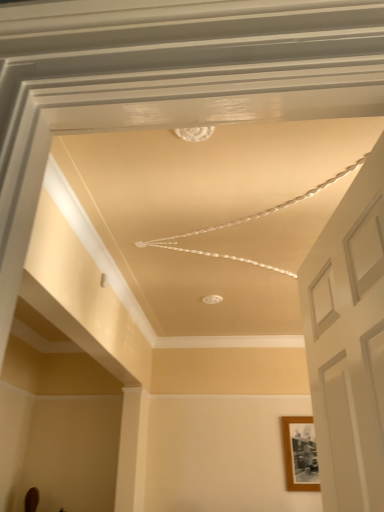
Question: Would you say white matte door at right is outside wooden photo frame at right?

Choices:
 (A) yes
 (B) no

Answer: (A)

Question: Does white matte door at right have a larger size compared to wooden photo frame at right?

Choices:
 (A) no
 (B) yes

Answer: (B)

Question: Can you confirm if white matte door at right is smaller than wooden photo frame at right?

Choices:
 (A) no
 (B) yes

Answer: (A)

Question: Could you tell me if white matte door at right is turned towards wooden photo frame at right?

Choices:
 (A) yes
 (B) no

Answer: (B)

Question: From the image's perspective, is white matte door at right under wooden photo frame at right?

Choices:
 (A) no
 (B) yes

Answer: (A)

Question: Can you confirm if white matte door at right is wider than wooden photo frame at right?

Choices:
 (A) yes
 (B) no

Answer: (A)

Question: Does wooden photo frame at right appear on the right side of white matte door at right?

Choices:
 (A) yes
 (B) no

Answer: (A)

Question: Is the depth of wooden photo frame at right less than that of white matte door at right?

Choices:
 (A) no
 (B) yes

Answer: (A)

Question: Considering the relative positions of wooden photo frame at right and white matte door at right in the image provided, is wooden photo frame at right behind white matte door at right?

Choices:
 (A) yes
 (B) no

Answer: (A)

Question: From a real-world perspective, is wooden photo frame at right located higher than white matte door at right?

Choices:
 (A) no
 (B) yes

Answer: (A)

Question: Does wooden photo frame at right have a greater width compared to white matte door at right?

Choices:
 (A) yes
 (B) no

Answer: (B)

Question: Is wooden photo frame at right not near white matte door at right?

Choices:
 (A) no
 (B) yes

Answer: (B)

Question: Is white matte door at right taller or shorter than wooden photo frame at right?

Choices:
 (A) tall
 (B) short

Answer: (A)